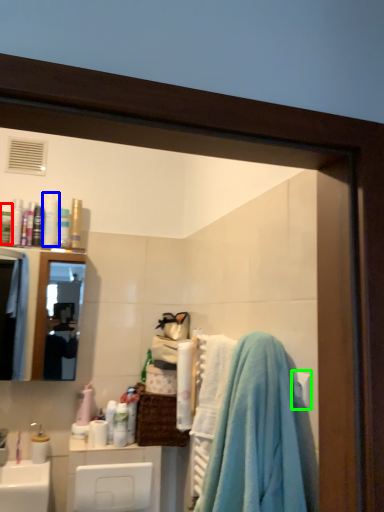
Question: Based on their relative distances, which object is nearer to toiletry (highlighted by a red box)? Choose from toiletry (highlighted by a blue box) and towel bar (highlighted by a green box).

Choices:
 (A) toiletry
 (B) towel bar

Answer: (A)